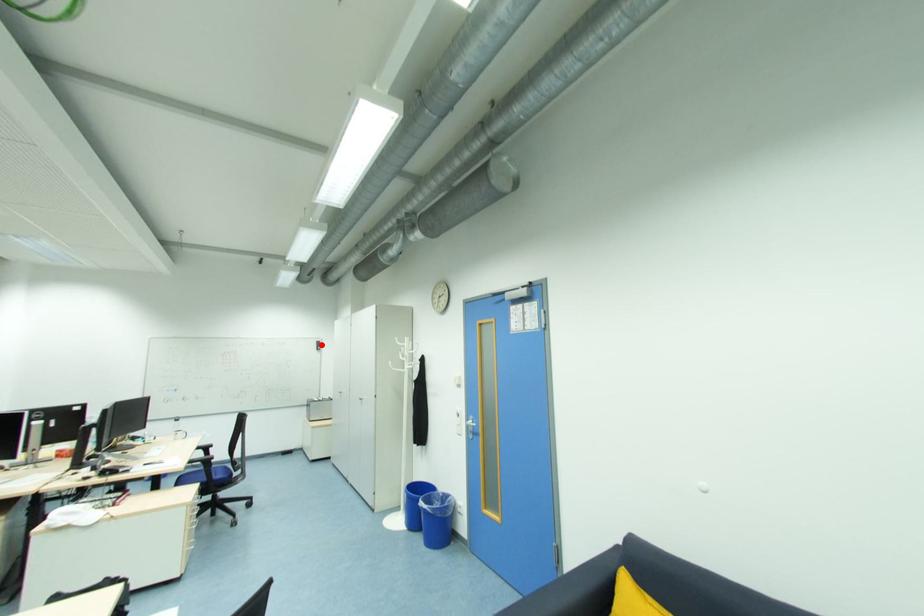
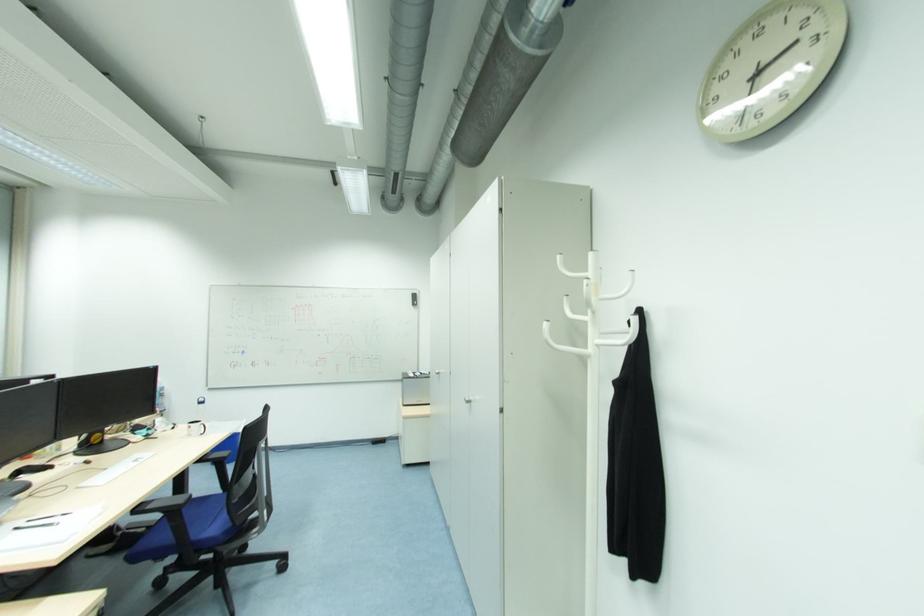
Question: A red point is marked in image1. In image2, is the corresponding 3D point closer to the camera or farther? Reply with the corresponding letter.

Choices:
 (A) The corresponding 3D point is closer.
 (B) The corresponding 3D point is farther.

Answer: (A)